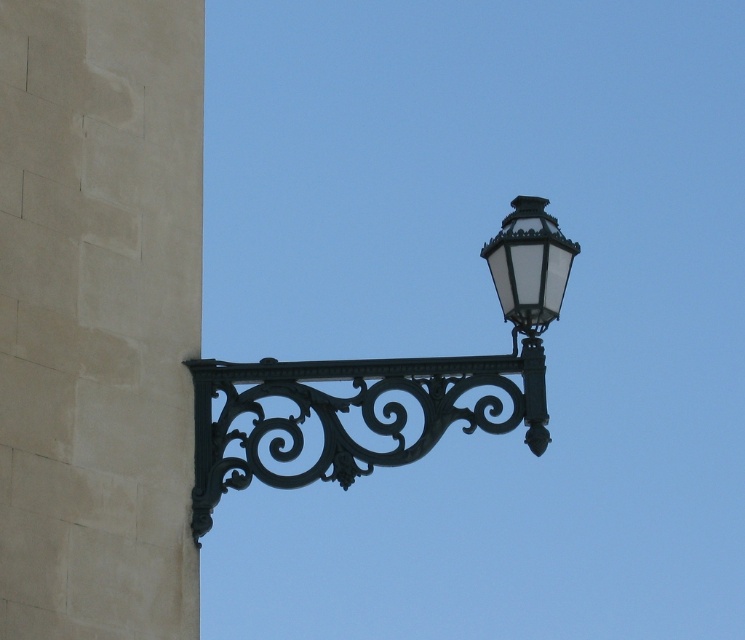
You are a city planner assessing the placement of two street lights on a wall. You notice the black wrought iron streetlight at upper right and the matte black street light at upper right. Which one is located below the other?

The black wrought iron streetlight at upper right is positioned under the matte black street light at upper right, so the wrought iron one is below the matte black one.

You are an architect designing a new building and want to place a black wrought iron streetlight at upper right on the wall. According to the image, what are the coordinates where you should place it?

The black wrought iron streetlight at upper right should be placed at coordinates point (387, 381).